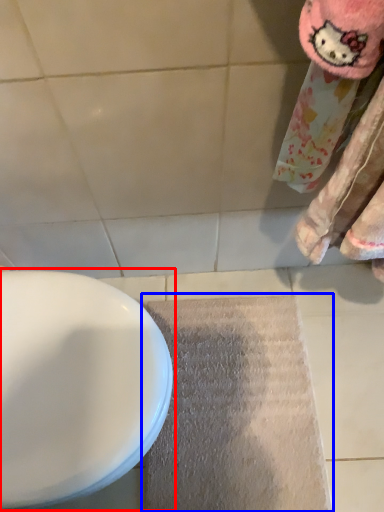
Question: Which of the following is the farthest to the observer, toilet (highlighted by a red box) or doormat (highlighted by a blue box)?

Choices:
 (A) toilet
 (B) doormat

Answer: (B)